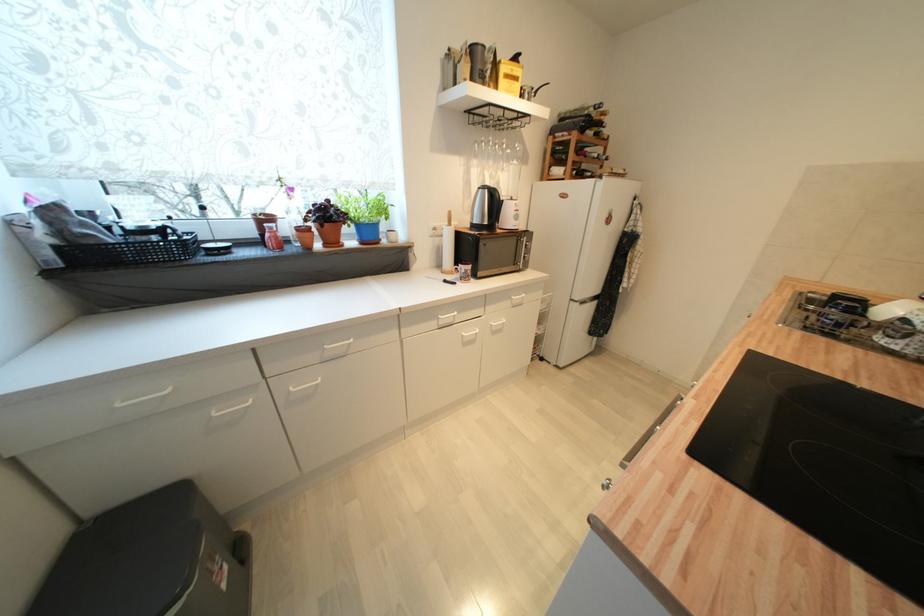
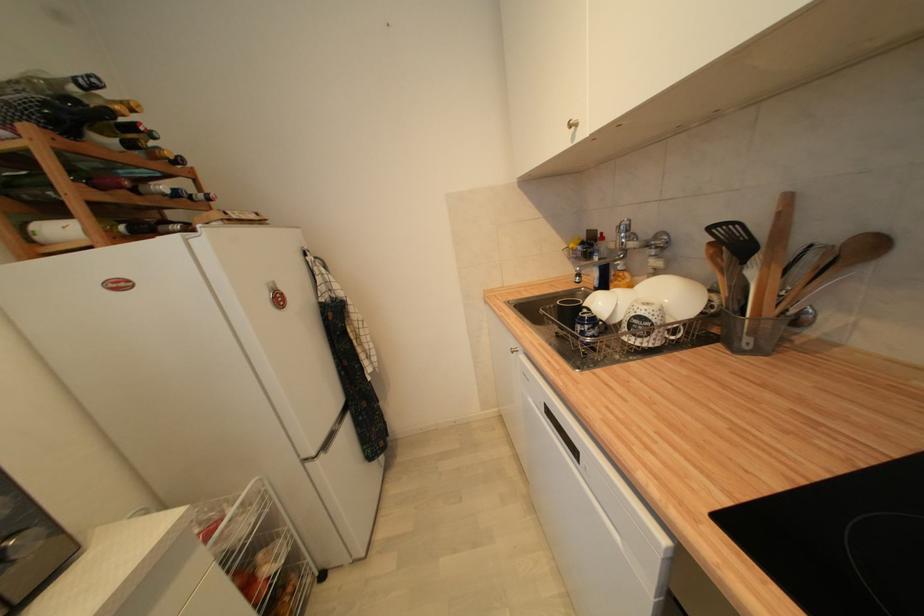
Question: How did the camera likely rotate?

Choices:
 (A) Left
 (B) Right
 (C) Up
 (D) Down

Answer: (B)